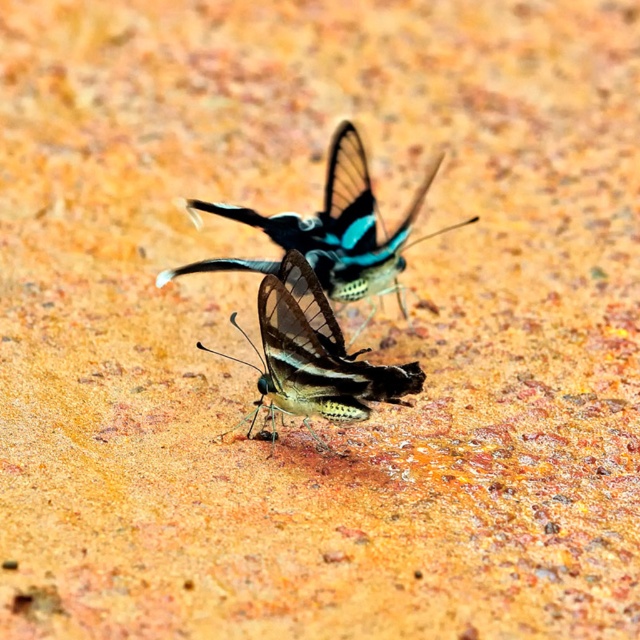
You are an entomologist observing two butterflies on a rocky surface. You notice the shiny metallic butterfly at center and the shiny blue butterfly at center. Based on their positions, which one is closer to the ground?

The shiny metallic butterfly at center is located below the shiny blue butterfly at center, so it is closer to the ground.

You are an entomologist observing two butterflies on a rocky surface. You notice the shiny metallic butterfly at center and the shiny blue butterfly at center. Which of these two butterflies is smaller in size?

The shiny metallic butterfly at center is smaller in size compared to the shiny blue butterfly at center.

You are an entomologist observing two butterflies on a rocky surface. You need to capture the shiny metallic butterfly at center and the shiny blue butterfly at center. Which one should you aim for first if you want to catch the one closer to your left side?

The shiny metallic butterfly at center is to the left of the shiny blue butterfly at center, so you should aim for the shiny metallic butterfly at center first since it is closer to your left side.